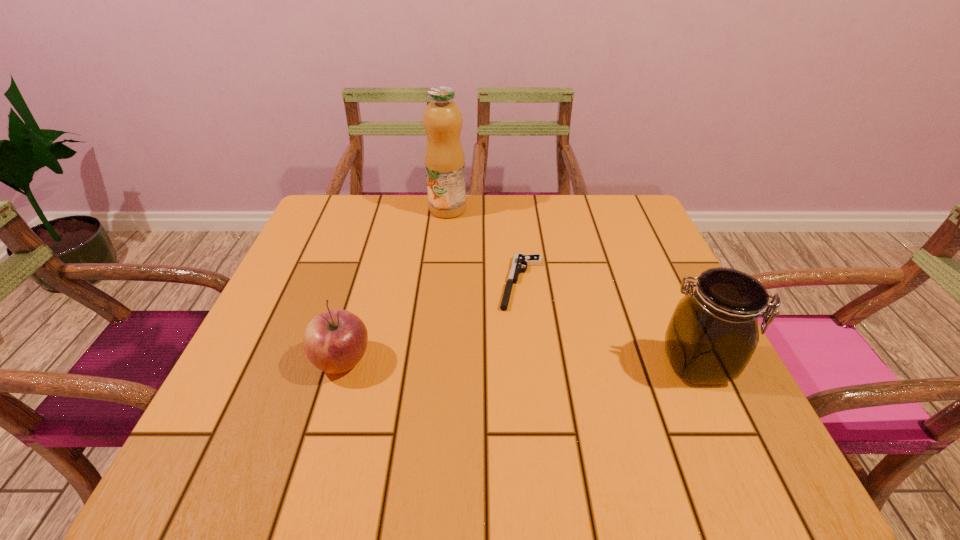
Where is `vacant region that satisfies the following two spatial constraints: 1. on the front side of the tallest object; 2. on the lid of the jar`? vacant region that satisfies the following two spatial constraints: 1. on the front side of the tallest object; 2. on the lid of the jar is located at coordinates (432, 364).

I want to click on free spot that satisfies the following two spatial constraints: 1. on the front side of the second farthest object; 2. on the right side of the tallest object, so click(440, 282).